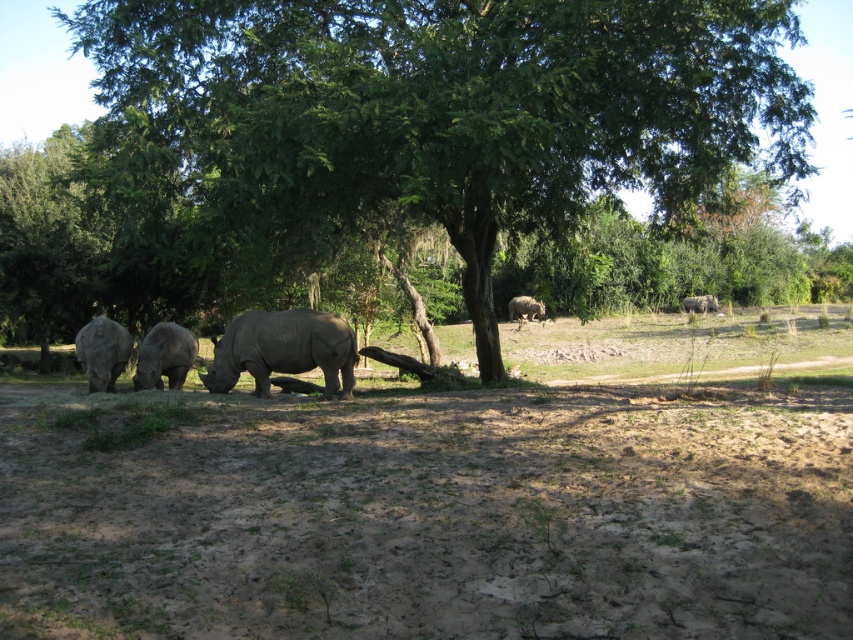
Question: Which object is positioned farthest from the gray matte rhinoceros at lower left?

Choices:
 (A) matte gray rhinoceros at center
 (B) matte gray rhinoceros at upper right
 (C) green leafy tree at center
 (D) brown sandy dirt at lower center

Answer: (B)

Question: Is the position of gray matte rhinoceros at center more distant than that of matte gray rhinoceros at center?

Choices:
 (A) yes
 (B) no

Answer: (B)

Question: Which object appears closest to the camera in this image?

Choices:
 (A) gray matte rhinoceros at center
 (B) matte gray rhinoceros at upper right
 (C) gray matte rhinoceros at lower left

Answer: (A)

Question: Which of the following is the farthest from the observer?

Choices:
 (A) gray matte rhinoceros at center
 (B) green leafy tree at center

Answer: (A)

Question: Is brown sandy dirt at lower center closer to camera compared to matte gray rhinoceros at left?

Choices:
 (A) yes
 (B) no

Answer: (A)

Question: Can you confirm if matte gray rhinoceros at center is positioned below matte gray rhinoceros at upper right?

Choices:
 (A) yes
 (B) no

Answer: (A)